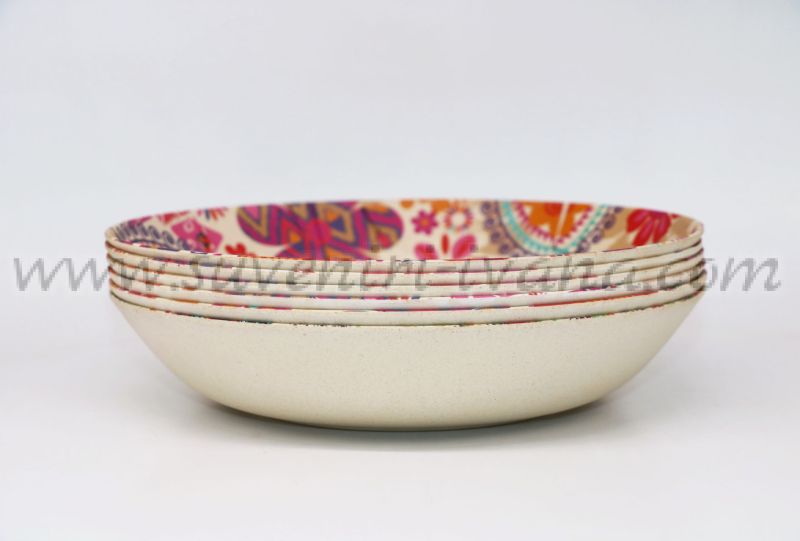
Find the location of a particular element. bowls is located at coordinates (366, 263), (366, 278), (365, 290), (362, 298), (365, 313), (366, 329).